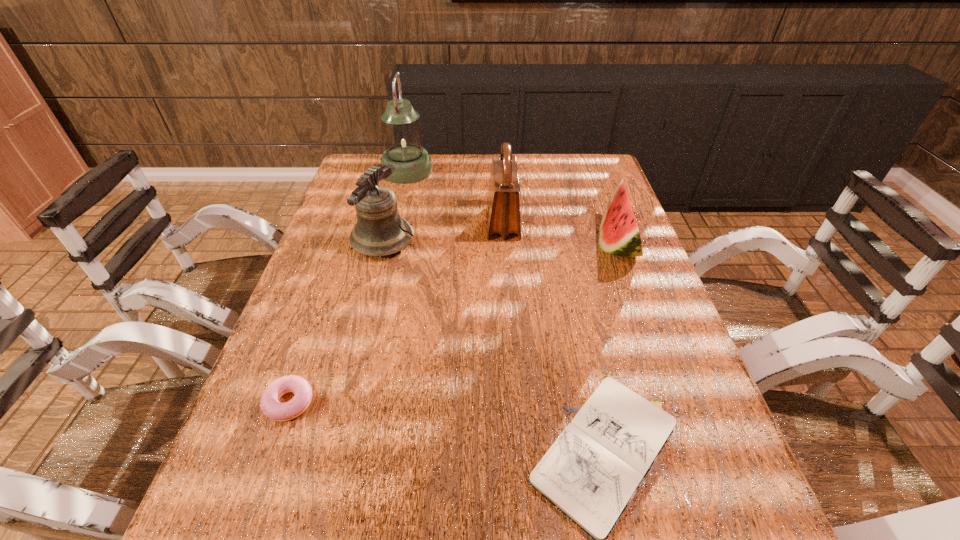
The width and height of the screenshot is (960, 540). What are the coordinates of `vacant space in between the bell and the shoulder bag` in the screenshot? It's located at (443, 232).

Image resolution: width=960 pixels, height=540 pixels. Find the location of `vacant space that is in between the farthest object and the shoulder bag`. vacant space that is in between the farthest object and the shoulder bag is located at coordinates (455, 197).

Find the location of a particular element. vacant space that is in between the fourth tallest object and the bell is located at coordinates (500, 243).

Locate which object ranks in proximity to the notebook. Please provide its 2D coordinates. Your answer should be formatted as a tuple, i.e. [(x, y)], where the tuple contains the x and y coordinates of a point satisfying the conditions above.

[(619, 235)]

Where is `object that stands as the third closest to the shoulder bag`? This screenshot has width=960, height=540. object that stands as the third closest to the shoulder bag is located at coordinates (402, 135).

This screenshot has width=960, height=540. Find the location of `vacant space that satisfies the following two spatial constraints: 1. on the back side of the bell; 2. on the right side of the second shortest object`. vacant space that satisfies the following two spatial constraints: 1. on the back side of the bell; 2. on the right side of the second shortest object is located at coordinates (347, 241).

Locate an element on the screen. Image resolution: width=960 pixels, height=540 pixels. free point that satisfies the following two spatial constraints: 1. on the back side of the farthest object; 2. on the right side of the doughnut is located at coordinates (372, 171).